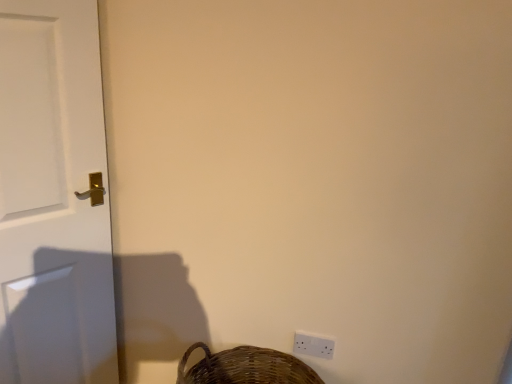
Question: Considering the positions of brown woven basket at lower right and white glossy door at left in the image, is brown woven basket at lower right bigger or smaller than white glossy door at left?

Choices:
 (A) small
 (B) big

Answer: (A)

Question: Relative to white glossy door at left, is brown woven basket at lower right in front or behind?

Choices:
 (A) front
 (B) behind

Answer: (B)

Question: Which is farther from the white glossy door at left?

Choices:
 (A) brown woven basket at lower right
 (B) white plastic light switch at lower right

Answer: (B)

Question: Which object is the farthest from the white plastic light switch at lower right?

Choices:
 (A) white glossy door at left
 (B) brown woven basket at lower right

Answer: (A)